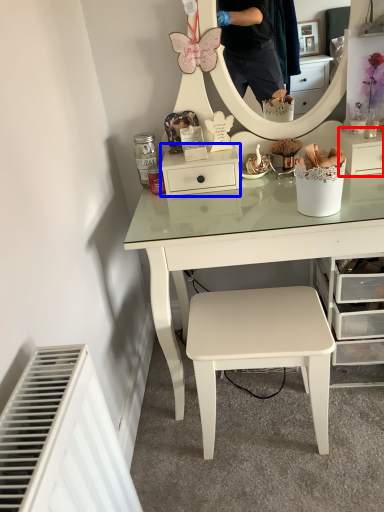
Question: Which object is further to the camera taking this photo, shelf (highlighted by a red box) or shelf (highlighted by a blue box)?

Choices:
 (A) shelf
 (B) shelf

Answer: (B)